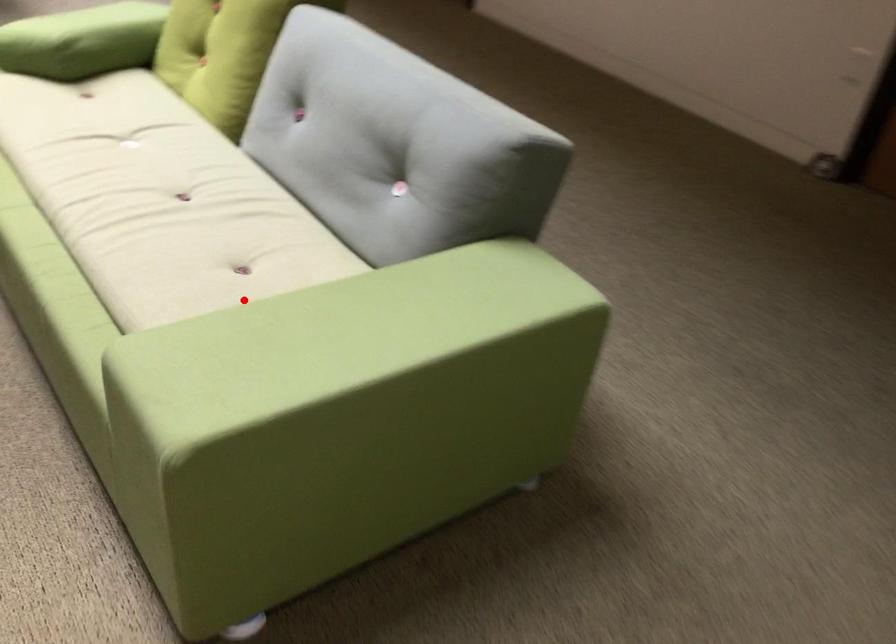
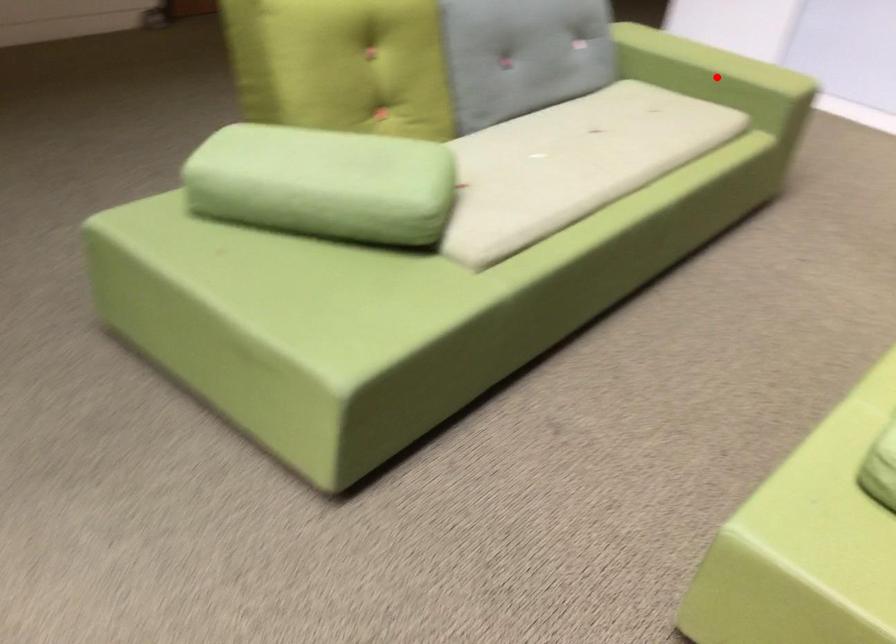
I am providing you with two images of the same scene from different viewpoints. A red point is marked on the first image and another point is marked on the second image. Is the red point in image1 aligned with the point shown in image2?

Yes